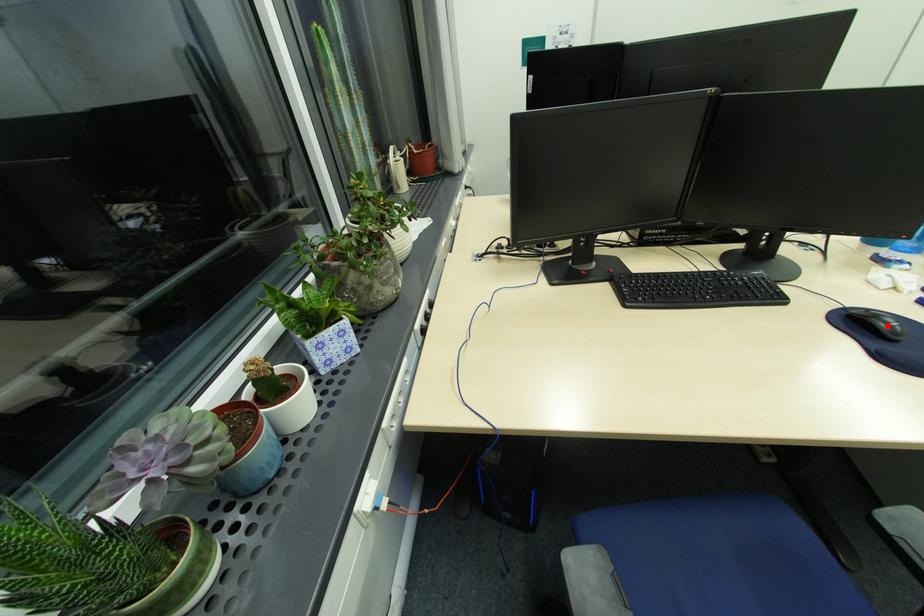
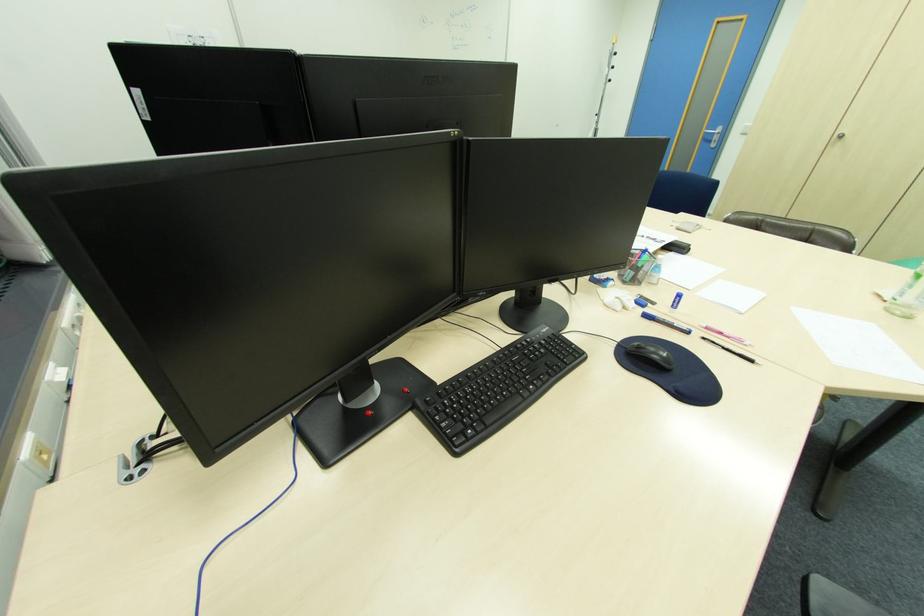
In the second image, find the point that corresponds to the highlighted location in the first image.

(662, 358)